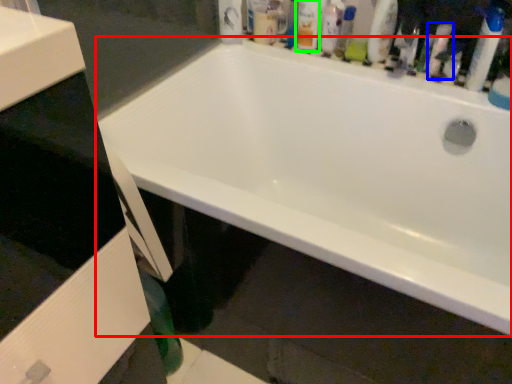
Question: Which is farther away from bathtub (highlighted by a red box)? cleaning product (highlighted by a blue box) or toiletry (highlighted by a green box)?

Choices:
 (A) cleaning product
 (B) toiletry

Answer: (A)